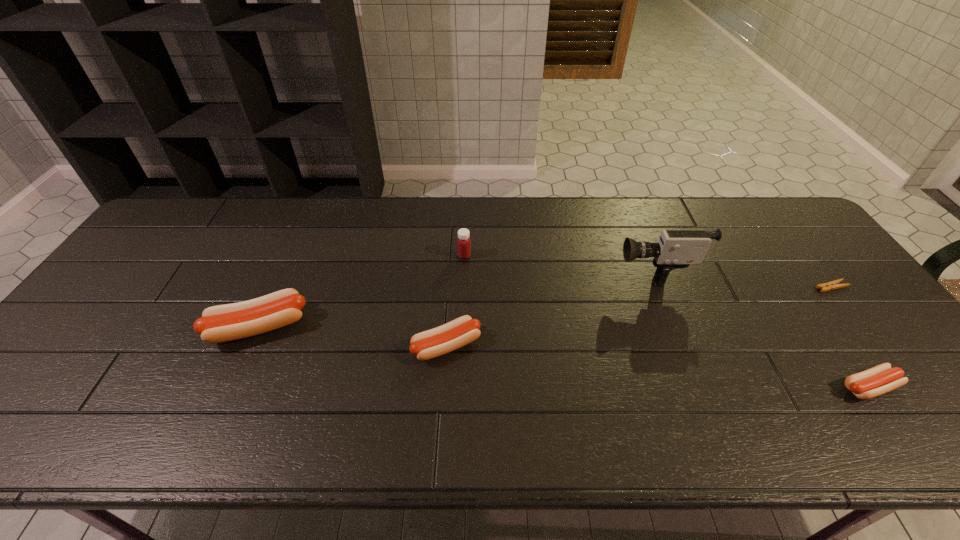
This screenshot has height=540, width=960. I want to click on the closest sausage to the shortest sausage, so click(457, 333).

Locate an element on the screen. This screenshot has width=960, height=540. sausage that can be found as the closest to the shortest sausage is located at coordinates (457, 333).

Locate an element on the screen. The image size is (960, 540). free space that satisfies the following two spatial constraints: 1. on the back side of the shortest sausage; 2. on the right side of the clothespin is located at coordinates (798, 287).